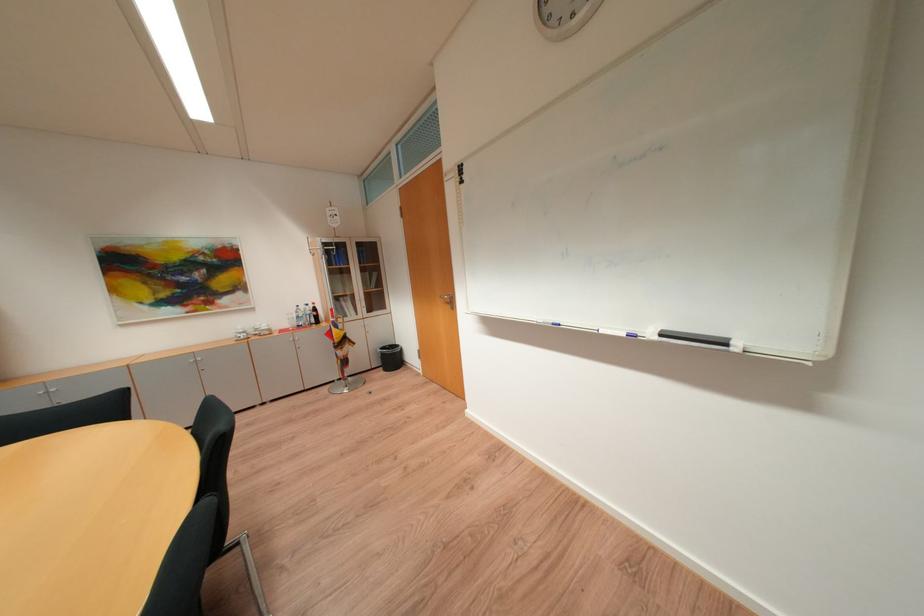
Where would you lift the red soda bottle? Please return your answer as a coordinate pair (x, y).

(314, 314)